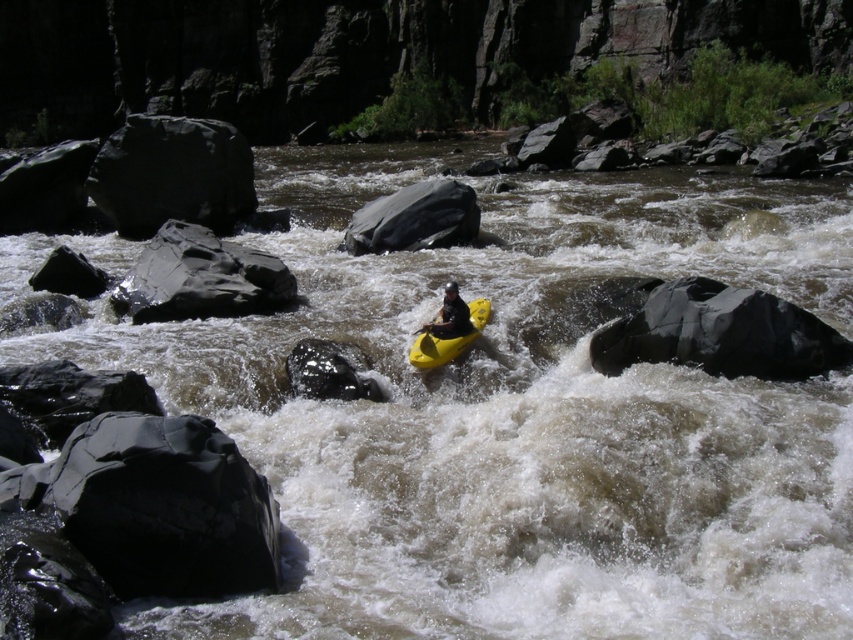
You are a kayaker in the yellow rubber canoe at center. You see a smooth gray rock at left in the river. Which direction should you paddle to avoid hitting the rock?

Since the smooth gray rock at left is located above the yellow rubber canoe at center, you should paddle to the right to avoid hitting the rock.

You are a kayaker trying to navigate through the river. You see a smooth gray rock at center and a yellow rubber canoe at center. Which object is higher above the water level?

The smooth gray rock at center is much taller than the yellow rubber canoe at center, so the smooth gray rock at center is higher above the water level.